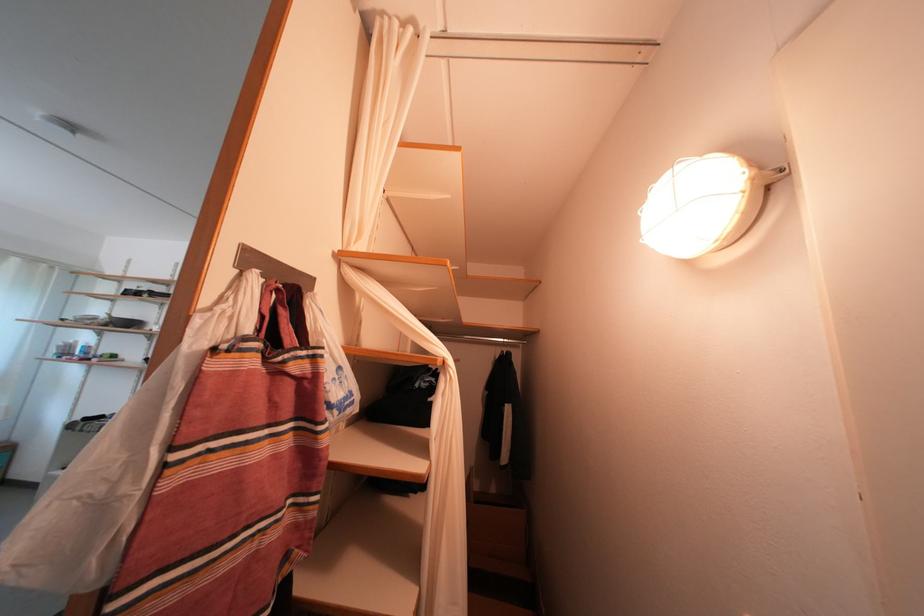
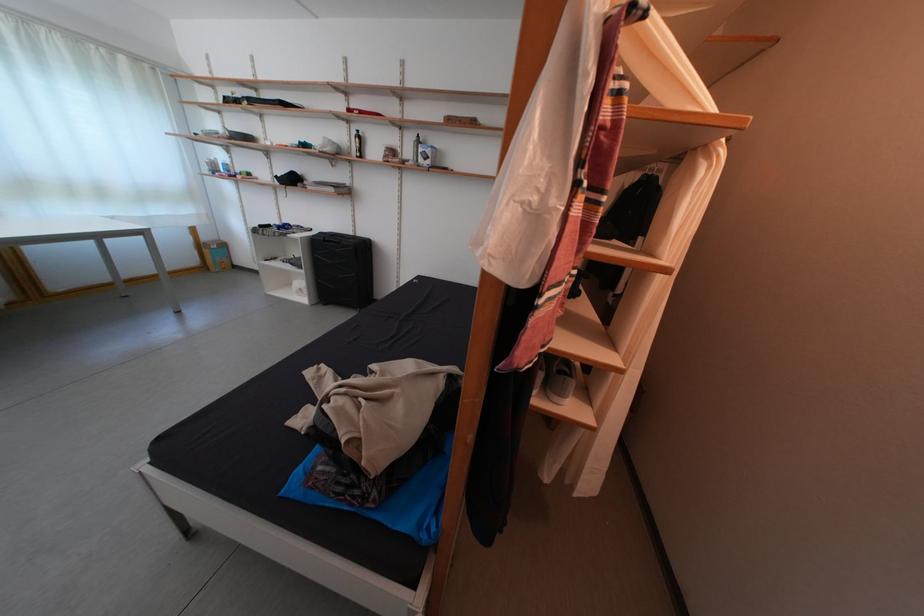
Question: The images are taken continuously from a first-person perspective. In which direction is your viewpoint rotating?

Choices:
 (A) Left
 (B) Right
 (C) Up
 (D) Down

Answer: (D)